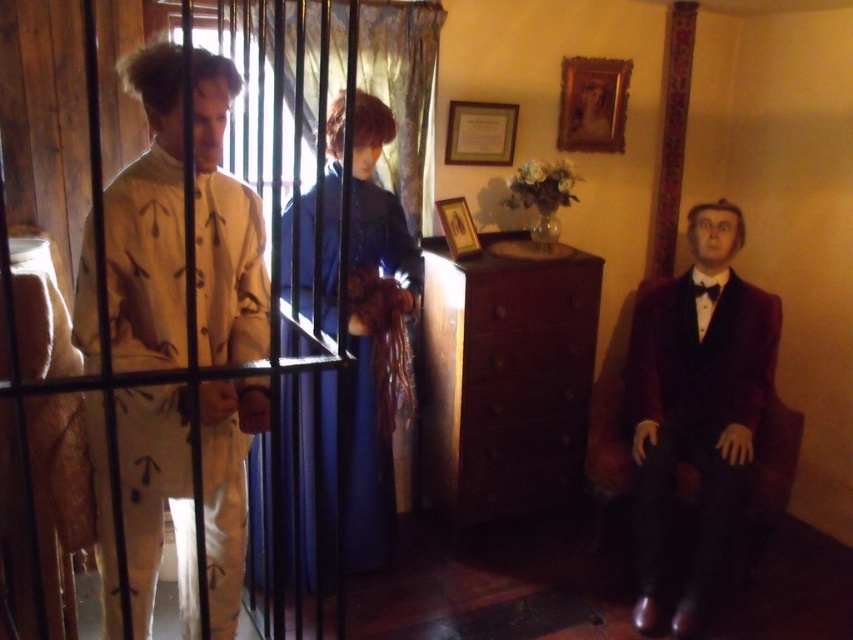
Question: Is velvet dark suit at right to the left of brown matte drawer at center from the viewer's perspective?

Choices:
 (A) yes
 (B) no

Answer: (B)

Question: Among these objects, which one is nearest to the camera?

Choices:
 (A) velvet dark suit at right
 (B) brushed metal cage at left
 (C) wooden dresser at center

Answer: (B)

Question: Is the position of wooden dresser at center more distant than that of velvet dark suit at right?

Choices:
 (A) no
 (B) yes

Answer: (B)

Question: Based on their relative distances, which object is farther from the wooden dresser at center?

Choices:
 (A) velvet blue dress at center
 (B) white matte jumpsuit at left
 (C) velvet dark suit at right
 (D) black satin bow tie at right

Answer: (B)

Question: Which object appears farthest from the camera in this image?

Choices:
 (A) brown matte drawer at center
 (B) velvet blue dress at center

Answer: (A)

Question: Where is white matte jumpsuit at left located in relation to black satin bow tie at right in the image?

Choices:
 (A) above
 (B) below

Answer: (B)